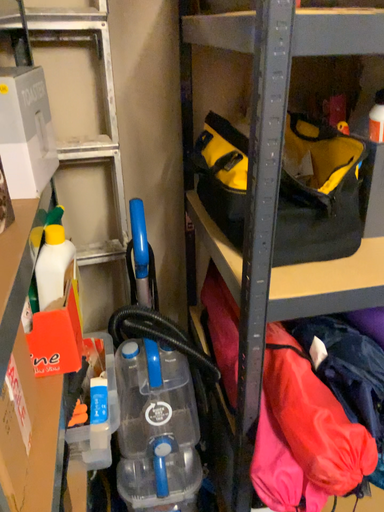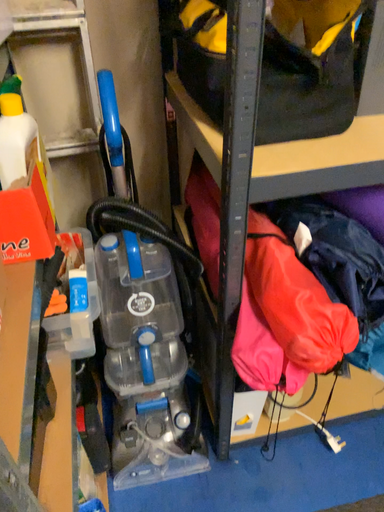
Question: How did the camera likely rotate when shooting the video?

Choices:
 (A) rotated downward
 (B) rotated upward

Answer: (A)